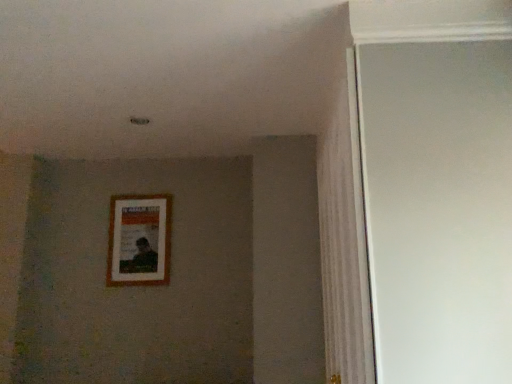
This screenshot has height=384, width=512. What do you see at coordinates (438, 208) in the screenshot? I see `white glossy door at right` at bounding box center [438, 208].

I want to click on white glossy door at right, so click(438, 208).

Based on the photo, measure the distance between point [127,227] and camera.

Point [127,227] is 9.02 feet from camera.

Identify the location of wooden picture frame at center. The image size is (512, 384). (139, 240).

This screenshot has width=512, height=384. What do you see at coordinates (139, 240) in the screenshot? I see `wooden picture frame at center` at bounding box center [139, 240].

Image resolution: width=512 pixels, height=384 pixels. What are the coordinates of `white glossy door at right` in the screenshot? It's located at (438, 208).

Looking at this image, which object is positioned more to the right, wooden picture frame at center or white glossy door at right?

From the viewer's perspective, white glossy door at right appears more on the right side.

Which is behind, wooden picture frame at center or white glossy door at right?

Positioned behind is wooden picture frame at center.

Is point (158, 248) closer or farther from the camera than point (416, 220)?

Clearly, point (158, 248) is more distant from the camera than point (416, 220).

From the image's perspective, is wooden picture frame at center above or below white glossy door at right?

From the image's perspective, wooden picture frame at center appears below white glossy door at right.

From a real-world perspective, is wooden picture frame at center under white glossy door at right?

No, from a real-world perspective, wooden picture frame at center is not below white glossy door at right.

Considering the sizes of objects wooden picture frame at center and white glossy door at right in the image provided, who is wider, wooden picture frame at center or white glossy door at right?

With larger width is white glossy door at right.

Is wooden picture frame at center shorter than white glossy door at right?

Indeed, wooden picture frame at center has a lesser height compared to white glossy door at right.

Between wooden picture frame at center and white glossy door at right, which one has larger size?

Bigger between the two is white glossy door at right.

Is wooden picture frame at center not within white glossy door at right?

Yes.

Is wooden picture frame at center far away from white glossy door at right?

Yes.

Does wooden picture frame at center turn towards white glossy door at right?

No.

Where is `picture frame located above the white glossy door at right (from a real-world perspective)`? Image resolution: width=512 pixels, height=384 pixels. picture frame located above the white glossy door at right (from a real-world perspective) is located at coordinates (139, 240).

Between white glossy door at right and wooden picture frame at center, which one appears on the right side from the viewer's perspective?

Positioned to the right is white glossy door at right.

Does white glossy door at right lie in front of wooden picture frame at center?

That is True.

Considering the positions of point (461, 296) and point (124, 200), is point (461, 296) closer or farther from the camera than point (124, 200)?

Point (461, 296) is closer to the camera than point (124, 200).

From the image's perspective, which one is positioned lower, white glossy door at right or wooden picture frame at center?

wooden picture frame at center appears lower in the image.

From a real-world perspective, which is physically above, white glossy door at right or wooden picture frame at center?

From a 3D spatial view, wooden picture frame at center is above.

Considering the sizes of objects white glossy door at right and wooden picture frame at center in the image provided, who is wider, white glossy door at right or wooden picture frame at center?

white glossy door at right is wider.

Which of these two, white glossy door at right or wooden picture frame at center, stands taller?

white glossy door at right is taller.

Who is smaller, white glossy door at right or wooden picture frame at center?

With smaller size is wooden picture frame at center.

Is white glossy door at right not inside wooden picture frame at center?

Yes, white glossy door at right is not within wooden picture frame at center.

Is white glossy door at right placed right next to wooden picture frame at center?

No, white glossy door at right is not in contact with wooden picture frame at center.

Consider the image. Could you tell me if white glossy door at right is turned towards wooden picture frame at center?

Yes, white glossy door at right is aimed at wooden picture frame at center.

How different are the orientations of white glossy door at right and wooden picture frame at center in degrees?

90.1 degrees.

Where is `picture frame below the white glossy door at right (from the image's perspective)`? The height and width of the screenshot is (384, 512). picture frame below the white glossy door at right (from the image's perspective) is located at coordinates (139, 240).

Identify the location of picture frame that is behind the white glossy door at right. This screenshot has height=384, width=512. (139, 240).

You are a GUI agent. You are given a task and a screenshot of the screen. Output one action in this format:
    pyautogui.click(x=<x>, y=<y>)
    Task: Click on the picture frame below the white glossy door at right (from the image's perspective)
    
    Given the screenshot: What is the action you would take?
    pyautogui.click(x=139, y=240)